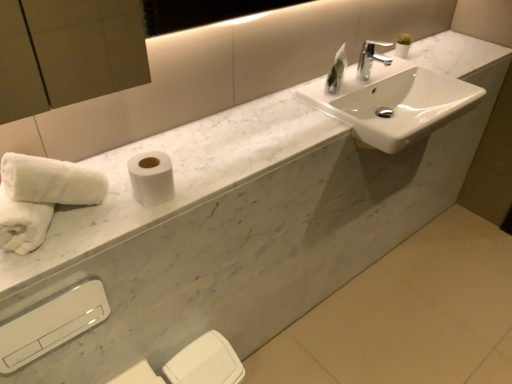
In order to click on free space above white marble counter top at center (from a real-world perspective) in this screenshot , I will do `click(271, 119)`.